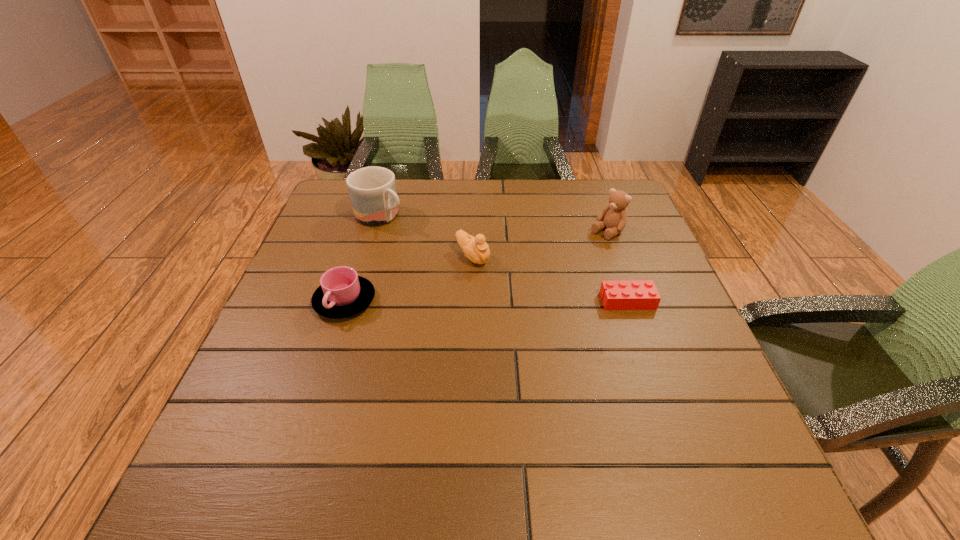
Image resolution: width=960 pixels, height=540 pixels. What are the coordinates of `vacant point that satisfies the following two spatial constraints: 1. on the front side of the mug; 2. on the left side of the third nearest object` in the screenshot? It's located at (368, 257).

Identify the location of vacant point that satisfies the following two spatial constraints: 1. on the front side of the shortest object; 2. on the left side of the mug. This screenshot has width=960, height=540. click(355, 301).